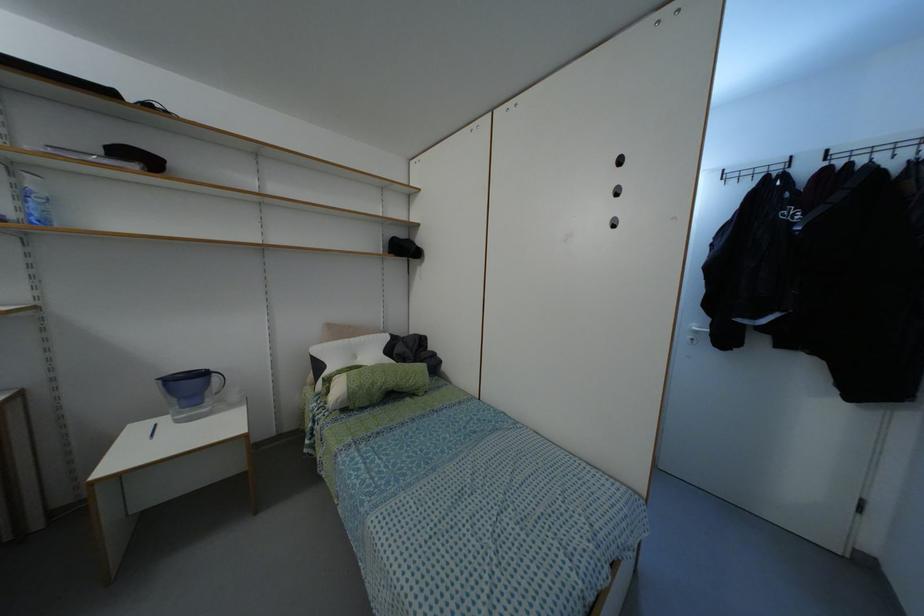
Where would you grasp the blue pen? Please return your answer as a coordinate pair (x, y).

(152, 430)